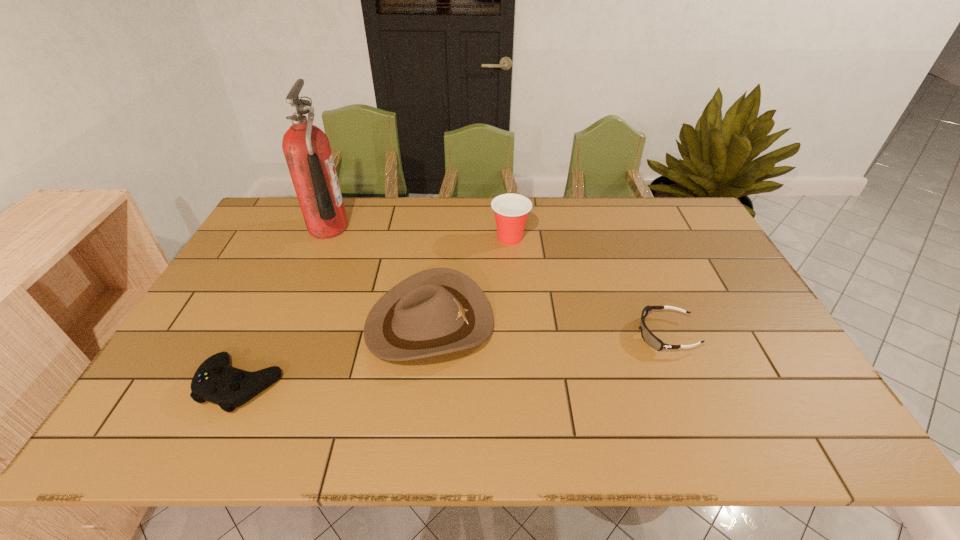
I want to click on free space located 0.210m on the front and sides of the goggles, so click(558, 334).

In order to click on free location located on the front and sides of the goggles in this screenshot , I will do `click(489, 334)`.

Where is `blank area located on the front and sides of the goggles`? blank area located on the front and sides of the goggles is located at coordinates (585, 334).

Locate an element on the screen. This screenshot has width=960, height=540. fire extinguisher situated at the far edge is located at coordinates (306, 148).

At what (x,y) coordinates should I click in order to perform the action: click on cup located at the far edge. Please return your answer as a coordinate pair (x, y). Looking at the image, I should click on (511, 210).

You are a GUI agent. You are given a task and a screenshot of the screen. Output one action in this format:
    pyautogui.click(x=<x>, y=<y>)
    Task: Click on the object that is at the near edge
    Image resolution: width=960 pixels, height=540 pixels.
    Given the screenshot: What is the action you would take?
    pyautogui.click(x=215, y=381)

Identify the location of object that is at the left edge. The image size is (960, 540). (215, 381).

Locate an element on the screen. The image size is (960, 540). object present at the near left corner is located at coordinates (215, 381).

Locate an element on the screen. This screenshot has width=960, height=540. vacant space at the far edge of the desktop is located at coordinates pyautogui.click(x=464, y=234).

Find the location of a particular element. vacant region at the near edge is located at coordinates (262, 442).